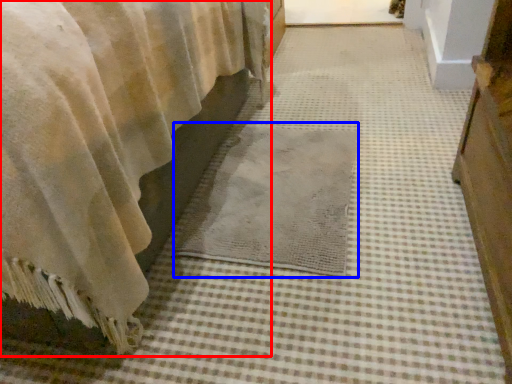
Question: Which object appears farthest to the camera in this image, curtain (highlighted by a red box) or mat (highlighted by a blue box)?

Choices:
 (A) curtain
 (B) mat

Answer: (B)